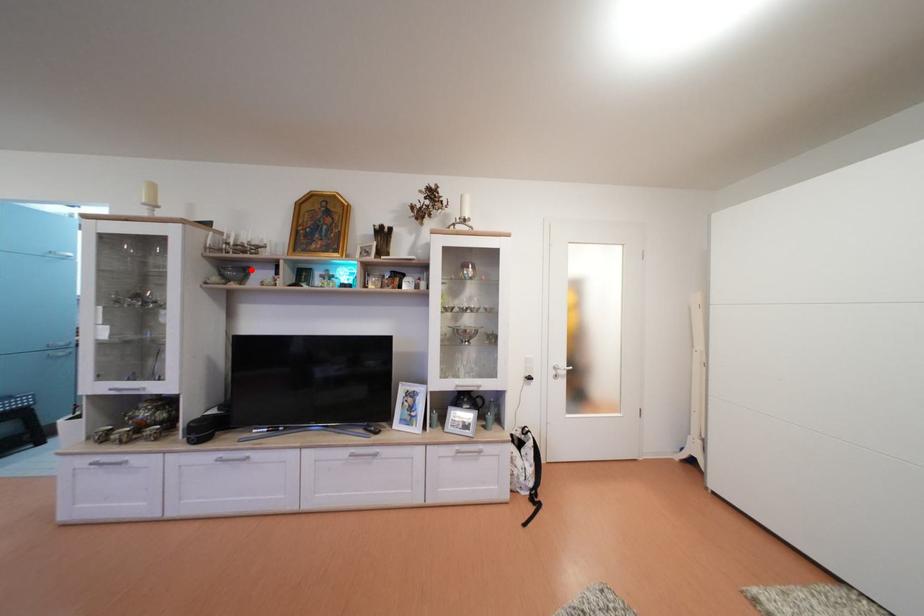
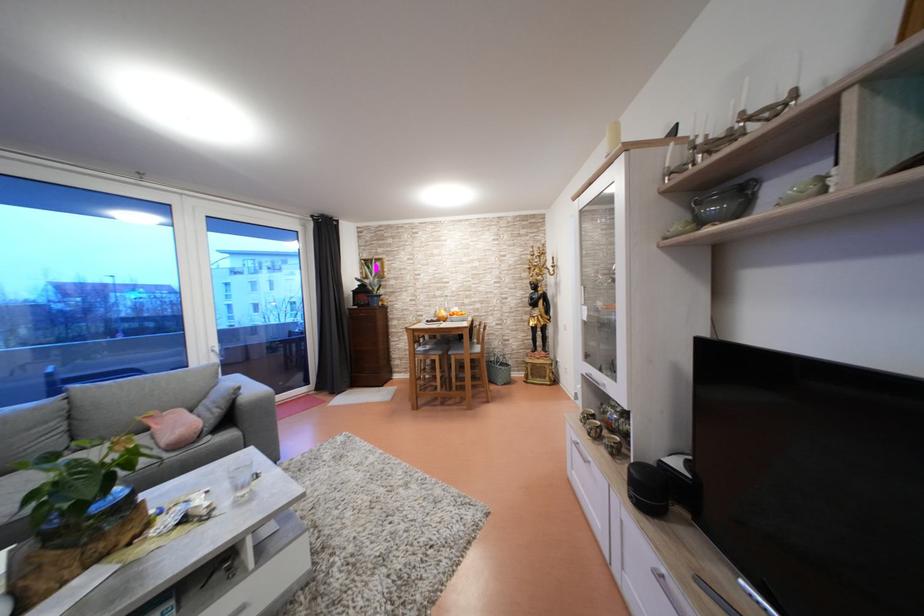
Locate, in the second image, the point that corresponds to the highlighted location in the first image.

(748, 185)